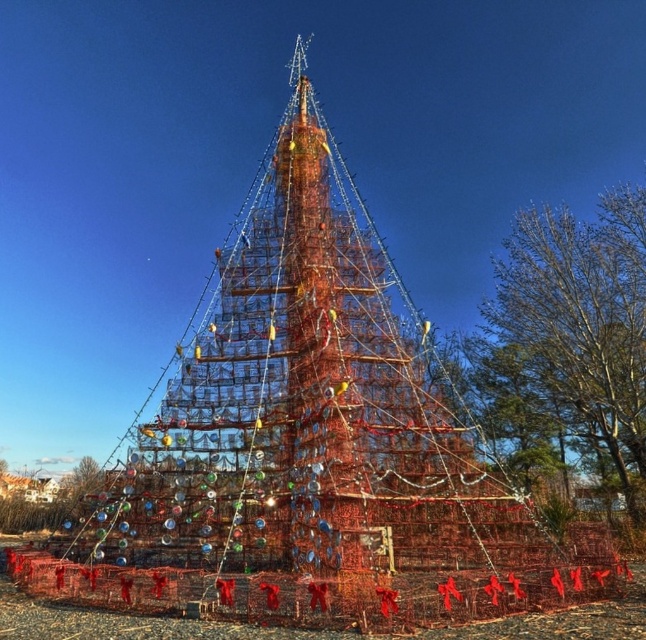
You are planning to place a new decoration on the metallic wireframe structure at center and the green leafy tree at right. Considering their sizes, which one might require a larger decoration to be noticeable from a distance?

The metallic wireframe structure at center is bigger than the green leafy tree at right, so it might require a larger decoration to be noticeable from a distance.

You are planning to place a new decoration on the Christmas tree. The decoration requires a space wider than the green leafy tree at right. Can the metallic wireframe structure at center accommodate this decoration?

The metallic wireframe structure at center has a width larger than the green leafy tree at right, so it can accommodate the decoration requiring a wider space.

You are standing in front of the lobster trap Christmas tree and notice a point marked at coordinates (306, 428). What does this point represent?

The point at (306, 428) represents the metallic wireframe structure at center of the lobster trap Christmas tree.